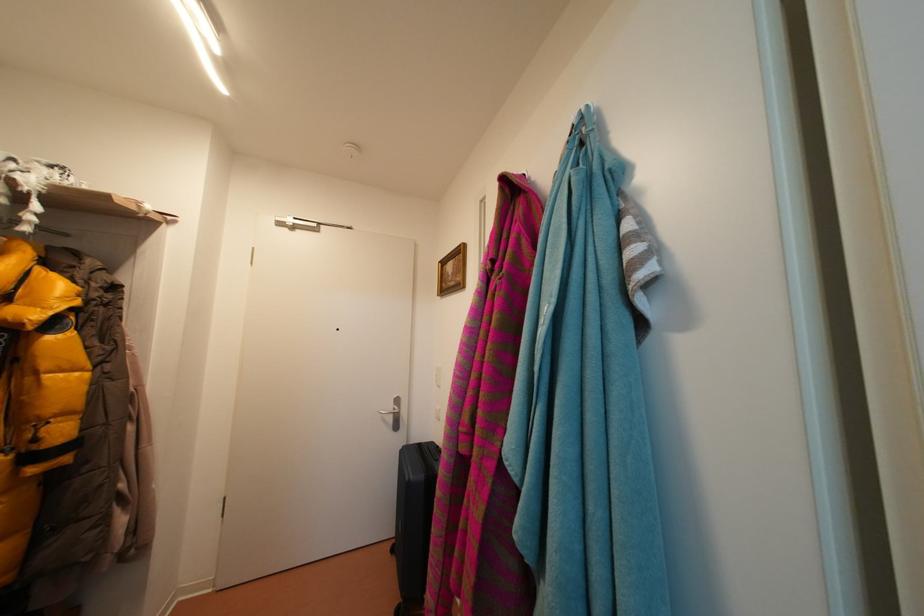
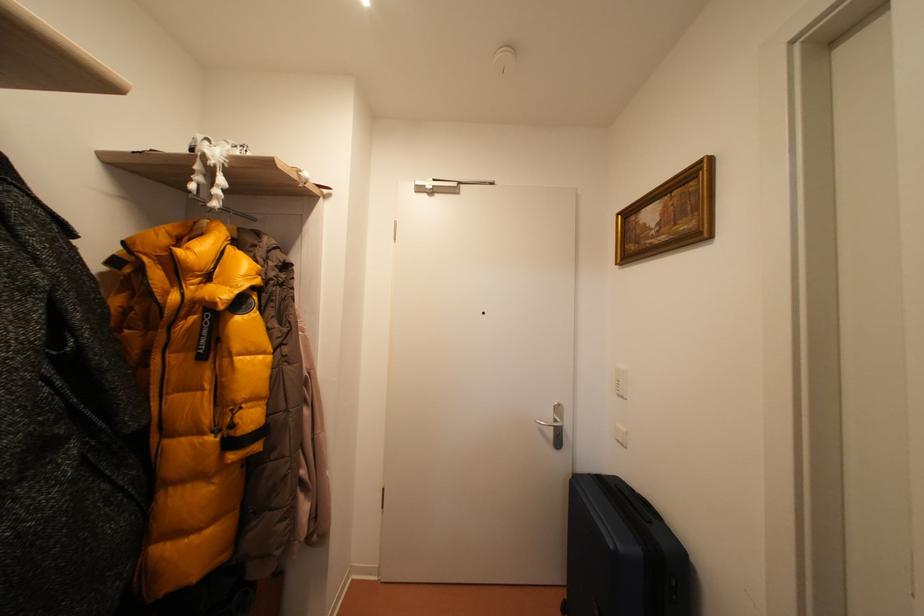
Question: The first image is from the beginning of the video and the second image is from the end. How did the camera likely rotate when shooting the video?

Choices:
 (A) Left
 (B) Right
 (C) Up
 (D) Down

Answer: (A)